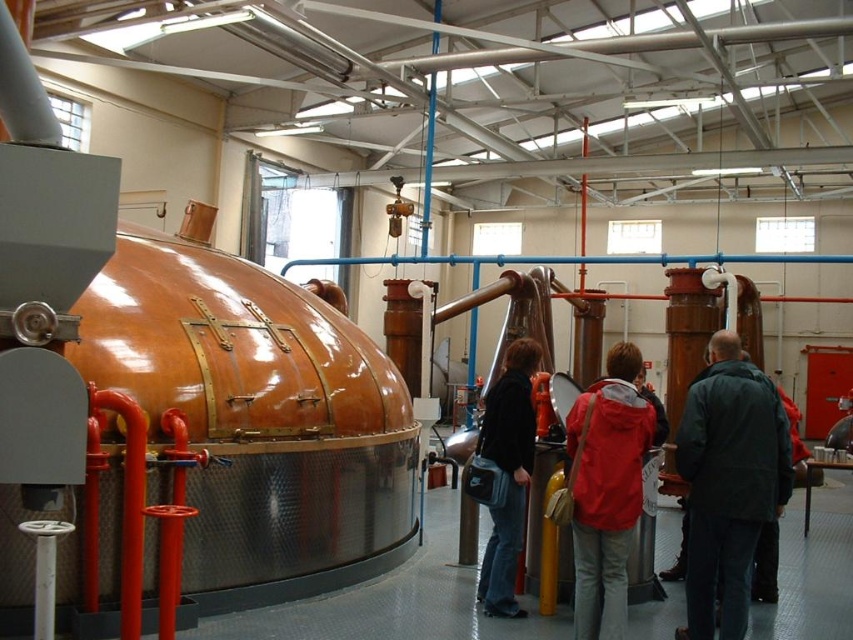
Question: Is red jacket at center below black leather jacket at center?

Choices:
 (A) yes
 (B) no

Answer: (B)

Question: Which point is farther to the camera?

Choices:
 (A) red jacket at center
 (B) black leather jacket at center

Answer: (B)

Question: Which point is farther from the camera taking this photo?

Choices:
 (A) (523, 504)
 (B) (730, 627)
 (C) (581, 525)

Answer: (A)

Question: Does red jacket at center appear over black leather jacket at center?

Choices:
 (A) no
 (B) yes

Answer: (B)

Question: Which is farther from the black leather jacket at center?

Choices:
 (A) red jacket at center
 (B) dark green jacket at center

Answer: (B)

Question: Does dark green jacket at center appear on the left side of black leather jacket at center?

Choices:
 (A) no
 (B) yes

Answer: (A)